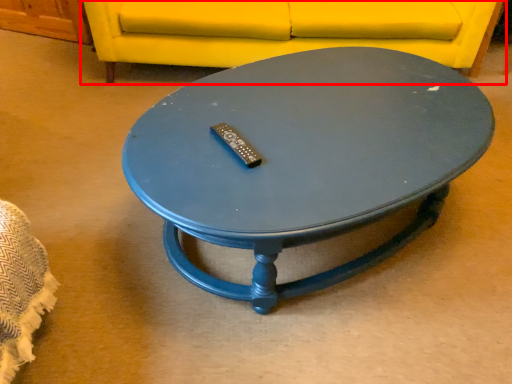
Question: Observing the image, what is the correct spatial positioning of studio couch (annotated by the red box) in reference to coffee table?

Choices:
 (A) left
 (B) right

Answer: (A)